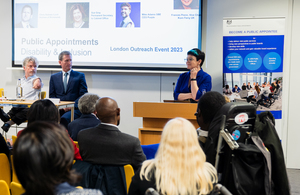
The image size is (300, 195). I want to click on chairs, so click(13, 187), click(1, 187), click(4, 170), click(13, 177), click(129, 173), click(13, 138).